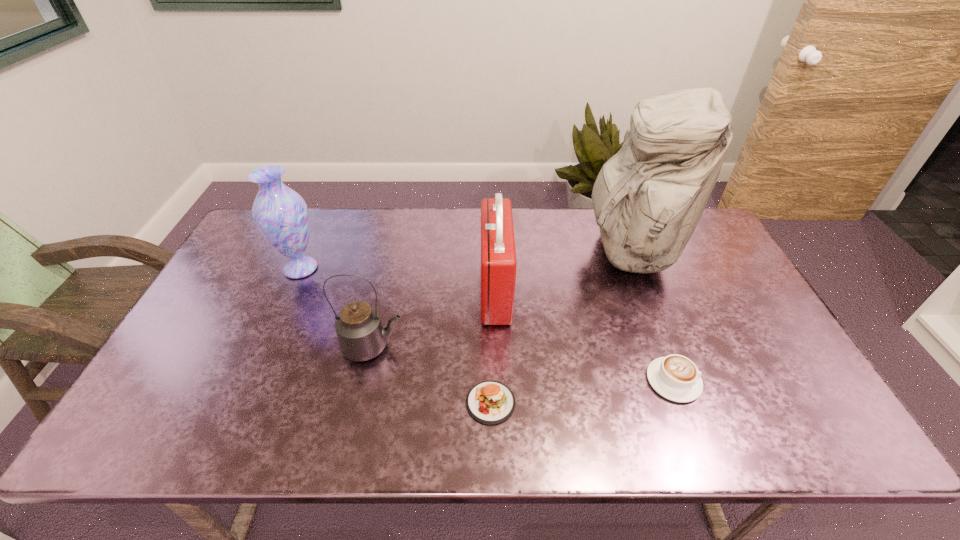
The width and height of the screenshot is (960, 540). I want to click on object present at the right edge, so click(648, 198).

The width and height of the screenshot is (960, 540). Identify the location of object that is positioned at the far right corner. (648, 198).

Find the location of a particular element. This screenshot has width=960, height=540. vacant space at the far edge is located at coordinates (571, 234).

Where is `free space at the near edge`? This screenshot has width=960, height=540. free space at the near edge is located at coordinates (660, 433).

At what (x,y) coordinates should I click in order to perform the action: click on free spot at the left edge of the desktop. Please return your answer as a coordinate pair (x, y). Looking at the image, I should click on (215, 285).

Locate an element on the screen. The width and height of the screenshot is (960, 540). vacant area at the right edge of the desktop is located at coordinates (699, 264).

You are a GUI agent. You are given a task and a screenshot of the screen. Output one action in this format:
    pyautogui.click(x=<x>, y=<y>)
    Task: Click on the vacant region between the leftmost object and the patty (food)
    This screenshot has height=540, width=960.
    Given the screenshot: What is the action you would take?
    pyautogui.click(x=396, y=335)

This screenshot has width=960, height=540. I want to click on free point between the shortest object and the first-aid kit, so click(x=493, y=347).

Where is `vacant point located between the fifth tallest object and the shortest object`? This screenshot has height=540, width=960. vacant point located between the fifth tallest object and the shortest object is located at coordinates (582, 392).

Where is `vacant area that lies between the vase and the fifth object from right to left`? vacant area that lies between the vase and the fifth object from right to left is located at coordinates (337, 307).